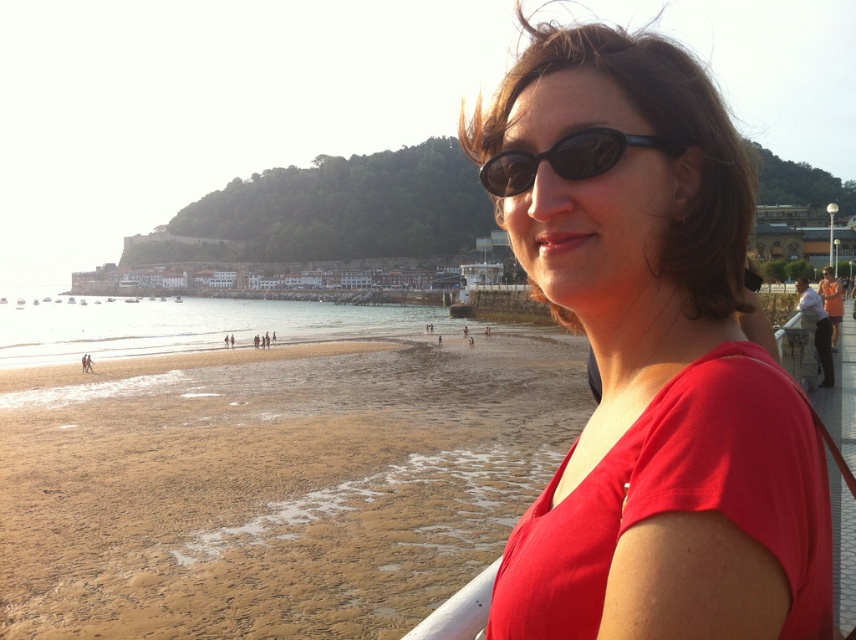
The woman in the scene is wearing a matte red shirt at center and has sunglasses at center. Which item is wider?

The matte red shirt at center is wider than the sunglasses at center.

You are a photographer trying to capture a shot of the woman on the walkway. You notice the sandy beach at lower left and the sunglasses at center. Which object is positioned to the left of the other?

The sandy beach at lower left is to the left of sunglasses at center.